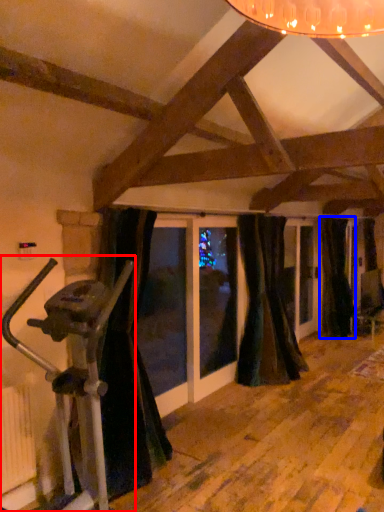
Question: Which of the following is the farthest to the observer, stationary bicycle (highlighted by a red box) or curtain (highlighted by a blue box)?

Choices:
 (A) stationary bicycle
 (B) curtain

Answer: (B)